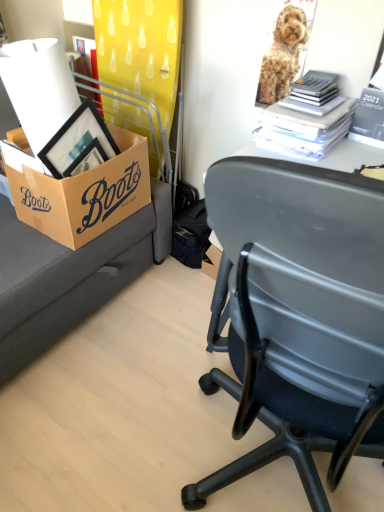
Question: Does black paper calendar at upper right, arranged as the 2th book when viewed from the left, have a greater width compared to white paper stack at upper right, which ranks as the 1th book in left-to-right order?

Choices:
 (A) no
 (B) yes

Answer: (A)

Question: Considering the relative sizes of black paper calendar at upper right, the first book viewed from the right, and white paper stack at upper right, which ranks as the 1th book in left-to-right order, in the image provided, is black paper calendar at upper right, the first book viewed from the right, thinner than white paper stack at upper right, which ranks as the 1th book in left-to-right order,?

Choices:
 (A) no
 (B) yes

Answer: (B)

Question: Considering the relative positions of black paper calendar at upper right, arranged as the 2th book when viewed from the left, and white paper stack at upper right, which ranks as the 1th book in left-to-right order, in the image provided, is black paper calendar at upper right, arranged as the 2th book when viewed from the left, behind white paper stack at upper right, which ranks as the 1th book in left-to-right order,?

Choices:
 (A) yes
 (B) no

Answer: (B)

Question: Is black paper calendar at upper right, arranged as the 2th book when viewed from the left, looking in the opposite direction of white paper stack at upper right, which ranks as the 1th book in left-to-right order?

Choices:
 (A) yes
 (B) no

Answer: (B)

Question: Does black paper calendar at upper right, arranged as the 2th book when viewed from the left, turn towards white paper stack at upper right, which is the second book in right-to-left order?

Choices:
 (A) no
 (B) yes

Answer: (A)

Question: Is black paper calendar at upper right, arranged as the 2th book when viewed from the left, closer to camera compared to white paper stack at upper right, which ranks as the 1th book in left-to-right order?

Choices:
 (A) no
 (B) yes

Answer: (B)

Question: Does black paper calendar at upper right, the first book viewed from the right, have a greater height compared to golden fur dog at upper right?

Choices:
 (A) yes
 (B) no

Answer: (B)

Question: Is black paper calendar at upper right, arranged as the 2th book when viewed from the left, far away from golden fur dog at upper right?

Choices:
 (A) yes
 (B) no

Answer: (B)

Question: Is black paper calendar at upper right, arranged as the 2th book when viewed from the left, outside of golden fur dog at upper right?

Choices:
 (A) yes
 (B) no

Answer: (A)

Question: Is black paper calendar at upper right, arranged as the 2th book when viewed from the left, further to camera compared to golden fur dog at upper right?

Choices:
 (A) no
 (B) yes

Answer: (A)

Question: Is black paper calendar at upper right, the first book viewed from the right, in front of golden fur dog at upper right?

Choices:
 (A) yes
 (B) no

Answer: (A)

Question: From a real-world perspective, is black paper calendar at upper right, the first book viewed from the right, on golden fur dog at upper right?

Choices:
 (A) no
 (B) yes

Answer: (A)

Question: Is white paper stack at upper right, which is the second book in right-to-left order, located outside black paper calendar at upper right, the first book viewed from the right?

Choices:
 (A) yes
 (B) no

Answer: (A)